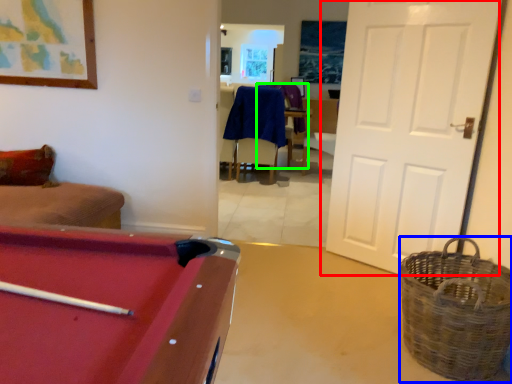
Question: Which is farther away from door (highlighted by a red box)? basket (highlighted by a blue box) or armchair (highlighted by a green box)?

Choices:
 (A) basket
 (B) armchair

Answer: (B)